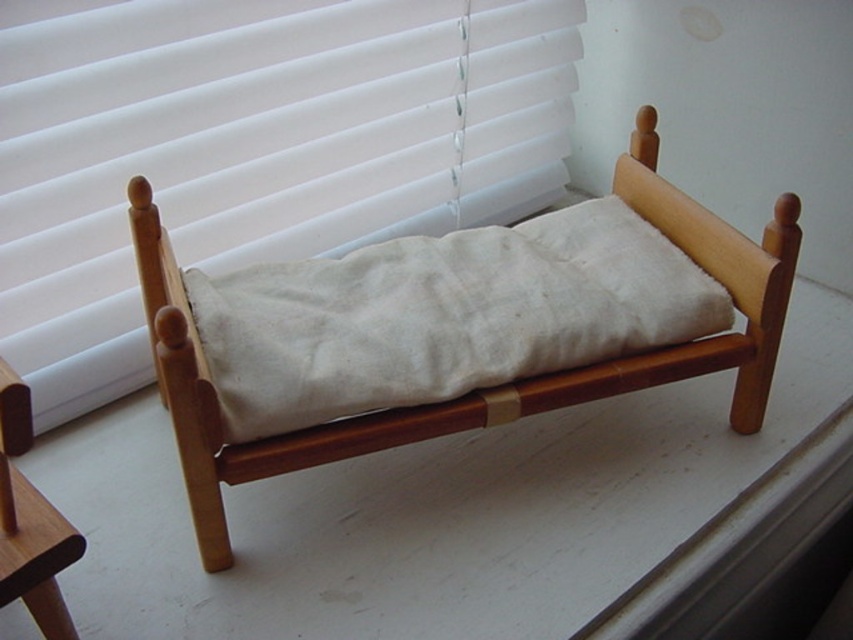
Can you confirm if white cotton blanket at center is wider than white cotton pillow at center?

Indeed, white cotton blanket at center has a greater width compared to white cotton pillow at center.

Identify the location of white cotton blanket at center. (444, 316).

Can you confirm if natural wood bed at center is wider than brown wood chair at lower left?

Yes.

Does natural wood bed at center appear under brown wood chair at lower left?

No, natural wood bed at center is not below brown wood chair at lower left.

Locate an element on the screen. The width and height of the screenshot is (853, 640). natural wood bed at center is located at coordinates (480, 390).

Can you confirm if white fabric blinds at upper center is positioned below natural wood bed at center?

No.

Which is behind, point (229, 257) or point (482, 420)?

The point (229, 257) is behind.

This screenshot has width=853, height=640. Describe the element at coordinates (251, 148) in the screenshot. I see `white fabric blinds at upper center` at that location.

At what (x,y) coordinates should I click in order to perform the action: click on white fabric blinds at upper center. Please return your answer as a coordinate pair (x, y). The width and height of the screenshot is (853, 640). Looking at the image, I should click on (251, 148).